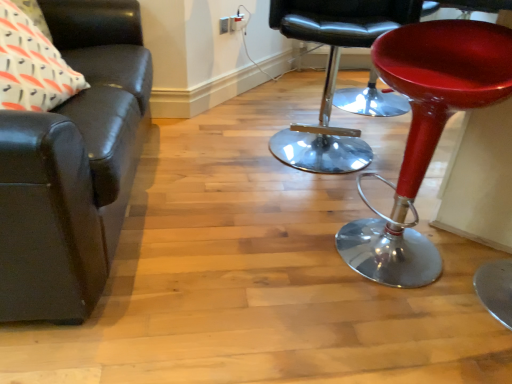
In order to face white printed fabric pillow at upper left, should I rotate leftwards or rightwards?

Rotate your view left by about 28.127°.

You are a GUI agent. You are given a task and a screenshot of the screen. Output one action in this format:
    pyautogui.click(x=<x>, y=<y>)
    Task: Click on the shiny chrome stool at center, placed as the 2th chair when sorted from left to right
    This screenshot has height=384, width=512.
    Given the screenshot: What is the action you would take?
    click(x=333, y=74)

Locate an element on the screen. The width and height of the screenshot is (512, 384). white printed fabric pillow at upper left is located at coordinates (32, 66).

In the image, is shiny chrome stool at center, marked as the 1th chair in a right-to-left arrangement, on the left side or the right side of white printed fabric pillow at upper left?

shiny chrome stool at center, marked as the 1th chair in a right-to-left arrangement, is to the right of white printed fabric pillow at upper left.

Can you tell me how much shiny chrome stool at center, placed as the 2th chair when sorted from left to right, and white printed fabric pillow at upper left differ in facing direction?

There is a 104-degree angle between the facing directions of shiny chrome stool at center, placed as the 2th chair when sorted from left to right, and white printed fabric pillow at upper left.

Does shiny chrome stool at center, placed as the 2th chair when sorted from left to right, lie in front of white printed fabric pillow at upper left?

No.

In terms of height, does shiny chrome stool at center, placed as the 2th chair when sorted from left to right, look taller or shorter compared to white printed fabric pillow at upper left?

Clearly, shiny chrome stool at center, placed as the 2th chair when sorted from left to right, is taller compared to white printed fabric pillow at upper left.

From a real-world perspective, is shiny red stool at right positioned above or below matte black leather couch at left, which is the second chair from right to left?

From a real-world perspective, shiny red stool at right is physically below matte black leather couch at left, which is the second chair from right to left.

Consider the image. Considering the relative positions of shiny red stool at right and matte black leather couch at left, which is counted as the 1th chair, starting from the left, in the image provided, is shiny red stool at right in front of matte black leather couch at left, which is counted as the 1th chair, starting from the left,?

No, shiny red stool at right is behind matte black leather couch at left, which is counted as the 1th chair, starting from the left.

Is white printed fabric pillow at upper left oriented away from shiny chrome stool at center, marked as the 1th chair in a right-to-left arrangement?

No.

From the image's perspective, is white printed fabric pillow at upper left above or below shiny chrome stool at center, marked as the 1th chair in a right-to-left arrangement?

white printed fabric pillow at upper left is above shiny chrome stool at center, marked as the 1th chair in a right-to-left arrangement.

Would you say white printed fabric pillow at upper left is a long distance from shiny chrome stool at center, placed as the 2th chair when sorted from left to right?

That's right, there is a large distance between white printed fabric pillow at upper left and shiny chrome stool at center, placed as the 2th chair when sorted from left to right.

Between white printed fabric pillow at upper left and shiny chrome stool at center, placed as the 2th chair when sorted from left to right, which one is positioned behind?

Positioned behind is shiny chrome stool at center, placed as the 2th chair when sorted from left to right.

Could you tell me if white printed fabric pillow at upper left is facing shiny red stool at right?

Yes, white printed fabric pillow at upper left is turned towards shiny red stool at right.

At what (x,y) coordinates should I click in order to perform the action: click on stool located underneath the white printed fabric pillow at upper left (from a real-world perspective). Please return your answer as a coordinate pair (x, y). This screenshot has height=384, width=512. Looking at the image, I should click on pos(425,134).

In the image, is white printed fabric pillow at upper left on the left side or the right side of shiny red stool at right?

white printed fabric pillow at upper left is to the left of shiny red stool at right.

Looking at their sizes, would you say white printed fabric pillow at upper left is wider or thinner than shiny red stool at right?

Clearly, white printed fabric pillow at upper left has less width compared to shiny red stool at right.

Is matte black leather couch at left, which is the second chair from right to left, looking in the opposite direction of white printed fabric pillow at upper left?

Correct, matte black leather couch at left, which is the second chair from right to left, is looking away from white printed fabric pillow at upper left.

Which is more to the left, matte black leather couch at left, which is counted as the 1th chair, starting from the left, or white printed fabric pillow at upper left?

white printed fabric pillow at upper left.

Which is behind, point (91, 167) or point (38, 88)?

The point (38, 88) is behind.

Is matte black leather couch at left, which is counted as the 1th chair, starting from the left, placed right next to white printed fabric pillow at upper left?

matte black leather couch at left, which is counted as the 1th chair, starting from the left, is not next to white printed fabric pillow at upper left, and they're not touching.

Is white printed fabric pillow at upper left inside the boundaries of matte black leather couch at left, which is counted as the 1th chair, starting from the left, or outside?

white printed fabric pillow at upper left is located inside matte black leather couch at left, which is counted as the 1th chair, starting from the left.

Relative to matte black leather couch at left, which is counted as the 1th chair, starting from the left, is white printed fabric pillow at upper left in front or behind?

Clearly, white printed fabric pillow at upper left is behind matte black leather couch at left, which is counted as the 1th chair, starting from the left.

From the image's perspective, does white printed fabric pillow at upper left appear higher than matte black leather couch at left, which is counted as the 1th chair, starting from the left?

Yes, from the image's perspective, white printed fabric pillow at upper left is above matte black leather couch at left, which is counted as the 1th chair, starting from the left.

Would you say white printed fabric pillow at upper left is to the left or to the right of matte black leather couch at left, which is the second chair from right to left, in the picture?

white printed fabric pillow at upper left is positioned on matte black leather couch at left, which is the second chair from right to left,'s left side.

Considering the relative sizes of shiny red stool at right and white printed fabric pillow at upper left in the image provided, is shiny red stool at right shorter than white printed fabric pillow at upper left?

No, shiny red stool at right is not shorter than white printed fabric pillow at upper left.

Identify the location of pillow located behind the shiny red stool at right. This screenshot has height=384, width=512. (32, 66).

Can you confirm if shiny red stool at right is bigger than white printed fabric pillow at upper left?

Yes.

Measure the distance from shiny red stool at right to white printed fabric pillow at upper left.

A distance of 1.05 meters exists between shiny red stool at right and white printed fabric pillow at upper left.

At what (x,y) coordinates should I click in order to perform the action: click on pillow that appears in front of the shiny chrome stool at center, marked as the 1th chair in a right-to-left arrangement. Please return your answer as a coordinate pair (x, y). This screenshot has height=384, width=512. Looking at the image, I should click on (32, 66).

Identify the location of chair below the shiny red stool at right (from the image's perspective). (73, 166).

Considering their positions, is matte black leather couch at left, which is the second chair from right to left, positioned further to white printed fabric pillow at upper left than shiny red stool at right?

shiny red stool at right is further to white printed fabric pillow at upper left.

Looking at the image, which one is located closer to matte black leather couch at left, which is the second chair from right to left, white printed fabric pillow at upper left or shiny red stool at right?

white printed fabric pillow at upper left.

Estimate the real-world distances between objects in this image. Which object is closer to matte black leather couch at left, which is counted as the 1th chair, starting from the left, shiny red stool at right or white printed fabric pillow at upper left?

white printed fabric pillow at upper left is positioned closer to the anchor matte black leather couch at left, which is counted as the 1th chair, starting from the left.

From the image, which object appears to be farther from shiny red stool at right, shiny chrome stool at center, placed as the 2th chair when sorted from left to right, or matte black leather couch at left, which is counted as the 1th chair, starting from the left?

matte black leather couch at left, which is counted as the 1th chair, starting from the left.

Which object lies nearer to the anchor point shiny red stool at right, white printed fabric pillow at upper left or shiny chrome stool at center, marked as the 1th chair in a right-to-left arrangement?

shiny chrome stool at center, marked as the 1th chair in a right-to-left arrangement, lies closer to shiny red stool at right than the other object.

From the image, which object appears to be nearer to white printed fabric pillow at upper left, shiny chrome stool at center, marked as the 1th chair in a right-to-left arrangement, or matte black leather couch at left, which is counted as the 1th chair, starting from the left?

matte black leather couch at left, which is counted as the 1th chair, starting from the left, lies closer to white printed fabric pillow at upper left than the other object.

Based on their spatial positions, is shiny red stool at right or shiny chrome stool at center, placed as the 2th chair when sorted from left to right, further from matte black leather couch at left, which is the second chair from right to left?

shiny red stool at right is further to matte black leather couch at left, which is the second chair from right to left.

Which object lies nearer to the anchor point shiny chrome stool at center, marked as the 1th chair in a right-to-left arrangement, white printed fabric pillow at upper left or shiny red stool at right?

Among the two, shiny red stool at right is located nearer to shiny chrome stool at center, marked as the 1th chair in a right-to-left arrangement.

Image resolution: width=512 pixels, height=384 pixels. What are the coordinates of `chair between white printed fabric pillow at upper left and shiny chrome stool at center, marked as the 1th chair in a right-to-left arrangement, from left to right` in the screenshot? It's located at (73, 166).

Identify the location of chair between matte black leather couch at left, which is counted as the 1th chair, starting from the left, and shiny red stool at right from left to right. The image size is (512, 384). (333, 74).